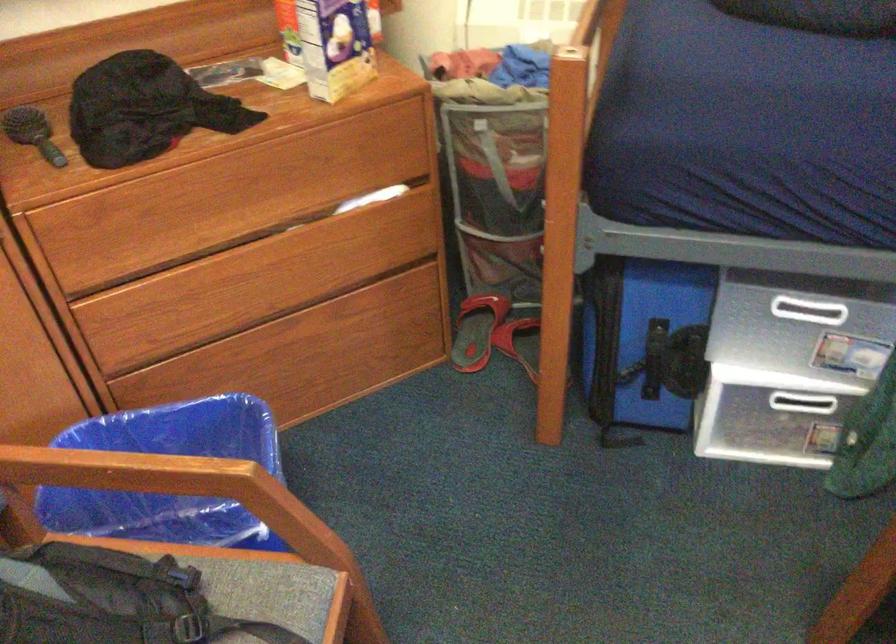
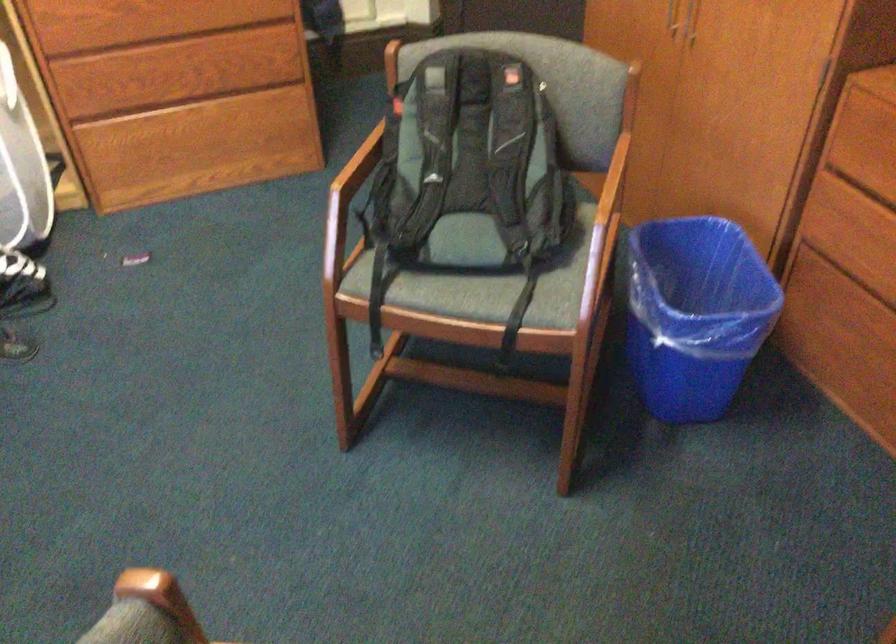
Locate, in the second image, the point that corresponds to the point at 175,464 in the first image.

(609, 201)